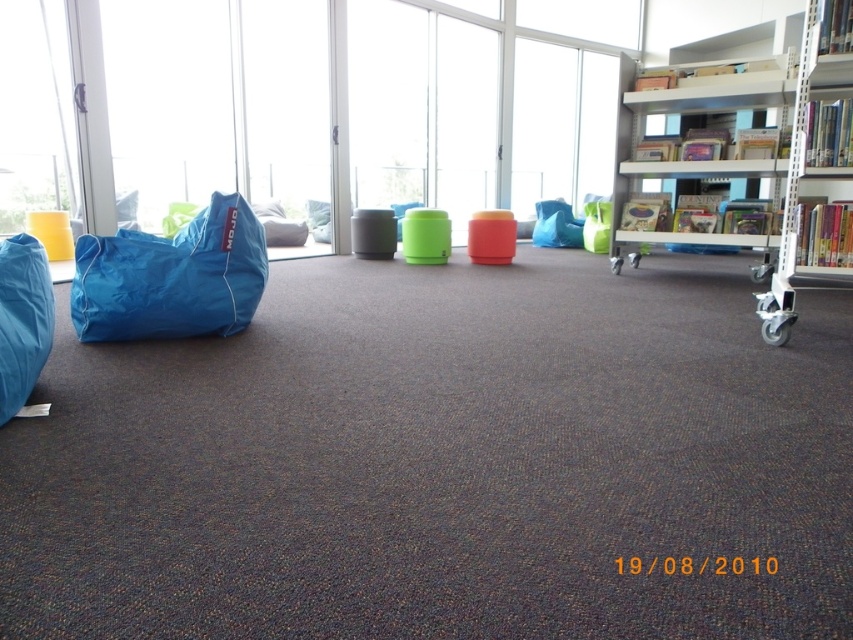
You are planning to rearrange the furniture in the lounge. You need to move the blue fabric beanbag at left and the white plastic shelf at right to make space for a new sofa. Which object should you move first to free up more space?

You should move the white plastic shelf at right first because it occupies more space than the blue fabric beanbag at left, freeing up more space for the new sofa.

You are standing in the center of the room and want to look outside through the transparent glass window at center. In which direction should you face to see the outside view?

The transparent glass window at center is located at point (306, 106), so you should face towards the direction indicated by those coordinates to look outside through it.

You are a delivery person carrying a large box that is 4 feet wide. You need to place it between the white metal shelf at upper right and the white plastic shelf at right. Is there enough space between them to fit the box?

The white metal shelf at upper right and the white plastic shelf at right are 4.41 feet apart from each other. Since the box is 4 feet wide, there is enough space between them to fit the box as the distance between the shelves is greater than the box width.